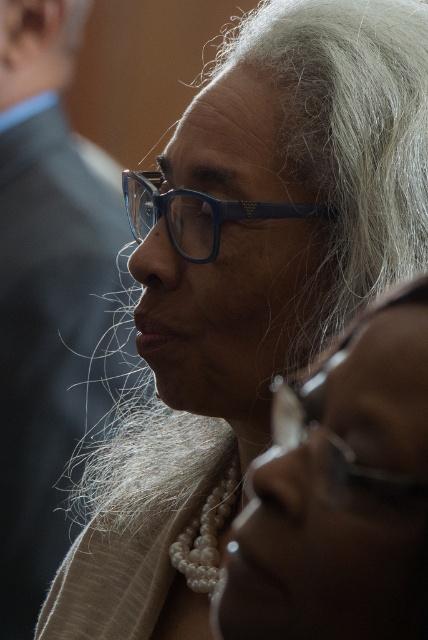
Question: Which point is closer to the camera?

Choices:
 (A) blue plastic glasses at center
 (B) pearl necklace at center

Answer: (B)

Question: Can you confirm if pearl necklace at center is positioned to the right of metallic silver glasses at lower right?

Choices:
 (A) yes
 (B) no

Answer: (B)

Question: Estimate the real-world distances between objects in this image. Which object is farther from the dark gray suit at left?

Choices:
 (A) pearl necklace at center
 (B) metallic silver glasses at lower right
 (C) blue plastic glasses at center

Answer: (B)

Question: Can you confirm if pearl necklace at center is wider than metallic silver glasses at lower right?

Choices:
 (A) no
 (B) yes

Answer: (B)

Question: Which of the following is the closest to the observer?

Choices:
 (A) blue plastic glasses at center
 (B) dark gray suit at left

Answer: (A)

Question: Does metallic silver glasses at lower right come behind blue plastic glasses at center?

Choices:
 (A) no
 (B) yes

Answer: (A)